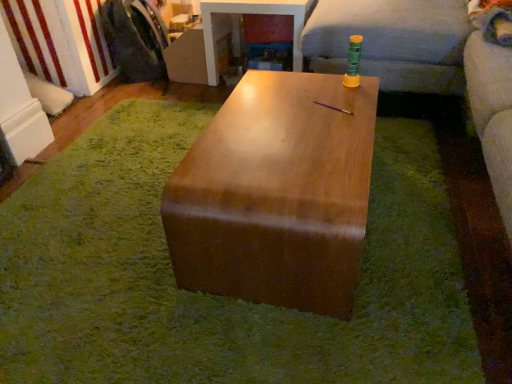
This screenshot has height=384, width=512. In order to click on free location to the right of glossy wood table at center, arranged as the first table when viewed from the front in this screenshot , I will do `click(402, 206)`.